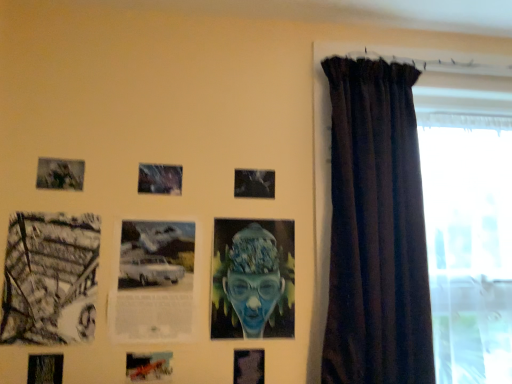
Question: Considering the positions of matte black photo frame at upper left, the sixth picture frame positioned from the right, and dark velvet curtain at right in the image, is matte black photo frame at upper left, the sixth picture frame positioned from the right, taller or shorter than dark velvet curtain at right?

Choices:
 (A) tall
 (B) short

Answer: (B)

Question: Is matte black photo frame at upper left, acting as the 3th picture frame starting from the left, spatially inside dark velvet curtain at right, or outside of it?

Choices:
 (A) inside
 (B) outside

Answer: (B)

Question: Which object is the farthest from the matte black photo frame at center, acting as the 1th picture frame starting from the right?

Choices:
 (A) black and white photograph at left, acting as the 7th picture frame starting from the right
 (B) transparent glass window at right
 (C) blue textured portrait at center
 (D) metallic silver car at center, which is counted as the fifth picture frame, starting from the left
 (E) matte black picture frame at lower center, which ranks as the 2th picture frame in right-to-left order

Answer: (B)

Question: Estimate the real-world distances between objects in this image. Which object is farther from the white paper with printed text at center, positioned as the third picture frame in right-to-left order?

Choices:
 (A) metallic silver car at center, which is counted as the fifth picture frame, starting from the left
 (B) matte black photo frame at upper left, acting as the 3th picture frame starting from the left
 (C) blue textured portrait at center
 (D) matte black picture frame at lower center, which ranks as the 2th picture frame in right-to-left order
 (E) black and white photograph at left, placed as the second picture frame when sorted from left to right

Answer: (B)